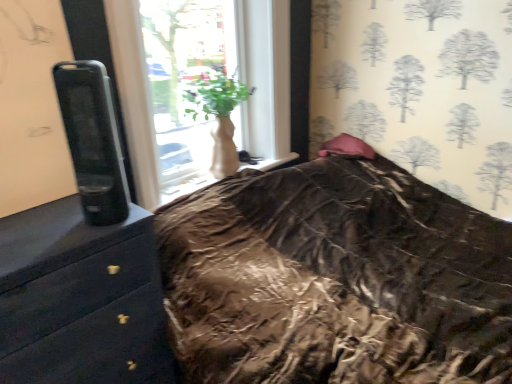
Consider the image. In order to face white matte vase at center, should I rotate leftwards or rightwards?

To align with it, rotate left about 3.194°.

Describe the element at coordinates (219, 118) in the screenshot. I see `white matte vase at center` at that location.

Describe the element at coordinates (347, 147) in the screenshot. The width and height of the screenshot is (512, 384). I see `pink satin pillow at upper right` at that location.

Locate an element on the screen. The height and width of the screenshot is (384, 512). pink satin pillow at upper right is located at coordinates (347, 147).

Locate an element on the screen. Image resolution: width=512 pixels, height=384 pixels. black glossy chest of drawers at left is located at coordinates (80, 299).

Is pink satin pillow at upper right surrounding black glossy chest of drawers at left?

No, black glossy chest of drawers at left is not surrounded by pink satin pillow at upper right.

Where is `pillow that appears behind the black glossy chest of drawers at left`? pillow that appears behind the black glossy chest of drawers at left is located at coordinates (347, 147).

In the scene shown: Is pink satin pillow at upper right positioned behind black glossy chest of drawers at left?

Yes, pink satin pillow at upper right is further from the camera.

From a real-world perspective, which is physically below, pink satin pillow at upper right or black glossy chest of drawers at left?

From a 3D spatial view, black glossy chest of drawers at left is below.

Can you confirm if black glossy chest of drawers at left is taller than white matte vase at center?

Indeed, black glossy chest of drawers at left has a greater height compared to white matte vase at center.

From the image's perspective, between black glossy chest of drawers at left and white matte vase at center, who is located below?

black glossy chest of drawers at left.

Is black glossy chest of drawers at left to the left of pink satin pillow at upper right from the viewer's perspective?

Correct, you'll find black glossy chest of drawers at left to the left of pink satin pillow at upper right.

From a real-world perspective, which is physically above, black glossy chest of drawers at left or pink satin pillow at upper right?

pink satin pillow at upper right is physically above.

Based on the photo, is black glossy chest of drawers at left positioned beyond the bounds of pink satin pillow at upper right?

Yes, black glossy chest of drawers at left is located beyond the bounds of pink satin pillow at upper right.

Considering the relative sizes of black glossy chest of drawers at left and pink satin pillow at upper right in the image provided, is black glossy chest of drawers at left bigger than pink satin pillow at upper right?

Yes.

In the image, is pink satin pillow at upper right positioned in front of or behind white matte vase at center?

Visually, pink satin pillow at upper right is located behind white matte vase at center.

Who is smaller, pink satin pillow at upper right or white matte vase at center?

With smaller size is pink satin pillow at upper right.

Identify the location of pillow to the right of white matte vase at center. Image resolution: width=512 pixels, height=384 pixels. (347, 147).

Considering the relative sizes of pink satin pillow at upper right and white matte vase at center in the image provided, is pink satin pillow at upper right wider than white matte vase at center?

No.

Consider the image. Would you say white matte vase at center contains black glossy chest of drawers at left?

No.

Looking at this image, between white matte vase at center and black glossy chest of drawers at left, which one has more height?

black glossy chest of drawers at left.

Is white matte vase at center next to black glossy chest of drawers at left and touching it?

No, white matte vase at center is not touching black glossy chest of drawers at left.

Does white matte vase at center have a larger size compared to black glossy chest of drawers at left?

Actually, white matte vase at center might be smaller than black glossy chest of drawers at left.

How distant is white matte vase at center from pink satin pillow at upper right?

white matte vase at center and pink satin pillow at upper right are 26.92 inches apart.

Between white matte vase at center and pink satin pillow at upper right, which one has larger size?

Bigger between the two is white matte vase at center.

Considering the sizes of objects white matte vase at center and pink satin pillow at upper right in the image provided, who is shorter, white matte vase at center or pink satin pillow at upper right?

pink satin pillow at upper right.

Is white matte vase at center touching pink satin pillow at upper right?

They are not placed beside each other.

Image resolution: width=512 pixels, height=384 pixels. What are the coordinates of `the chest of drawers that appears below the pink satin pillow at upper right (from the image's perspective)` in the screenshot? It's located at (80, 299).

There is a black glossy chest of drawers at left. At what (x,y) coordinates should I click in order to perform the action: click on houseplant above it (from a real-world perspective). Please return your answer as a coordinate pair (x, y). Looking at the image, I should click on (219, 118).

When comparing their distances from white matte vase at center, does pink satin pillow at upper right or black glossy chest of drawers at left seem further?

Among the two, black glossy chest of drawers at left is located further to white matte vase at center.

When comparing their distances from pink satin pillow at upper right, does white matte vase at center or black glossy chest of drawers at left seem further?

black glossy chest of drawers at left is positioned further to the anchor pink satin pillow at upper right.

Based on the photo, estimate the real-world distances between objects in this image. Which object is further from black glossy chest of drawers at left, pink satin pillow at upper right or white matte vase at center?

Among the two, pink satin pillow at upper right is located further to black glossy chest of drawers at left.

In the scene shown: From the image, which object appears to be farther from pink satin pillow at upper right, black glossy chest of drawers at left or white matte vase at center?

Among the two, black glossy chest of drawers at left is located further to pink satin pillow at upper right.

Based on their spatial positions, is white matte vase at center or pink satin pillow at upper right closer to black glossy chest of drawers at left?

white matte vase at center.

Considering their positions, is black glossy chest of drawers at left positioned closer to white matte vase at center than pink satin pillow at upper right?

pink satin pillow at upper right is positioned closer to the anchor white matte vase at center.

The width and height of the screenshot is (512, 384). I want to click on houseplant between black glossy chest of drawers at left and pink satin pillow at upper right in the front-back direction, so click(219, 118).